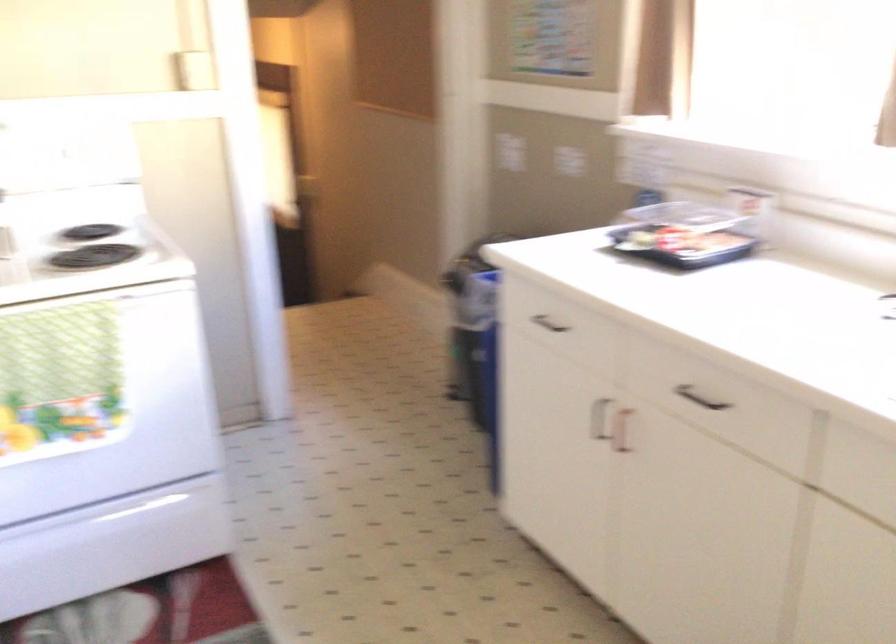
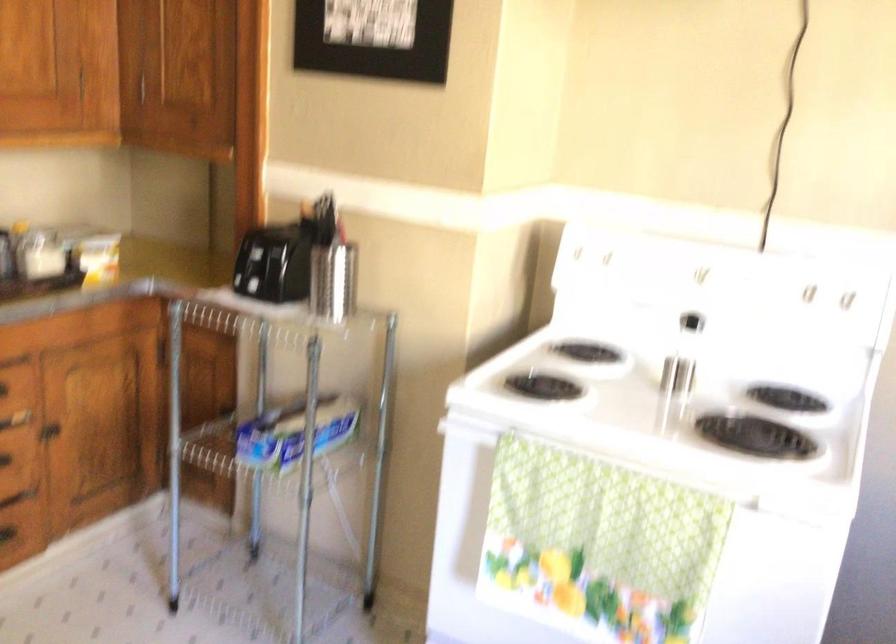
Find the pixel in the second image that matches the point at 128,149 in the first image.

(845, 299)